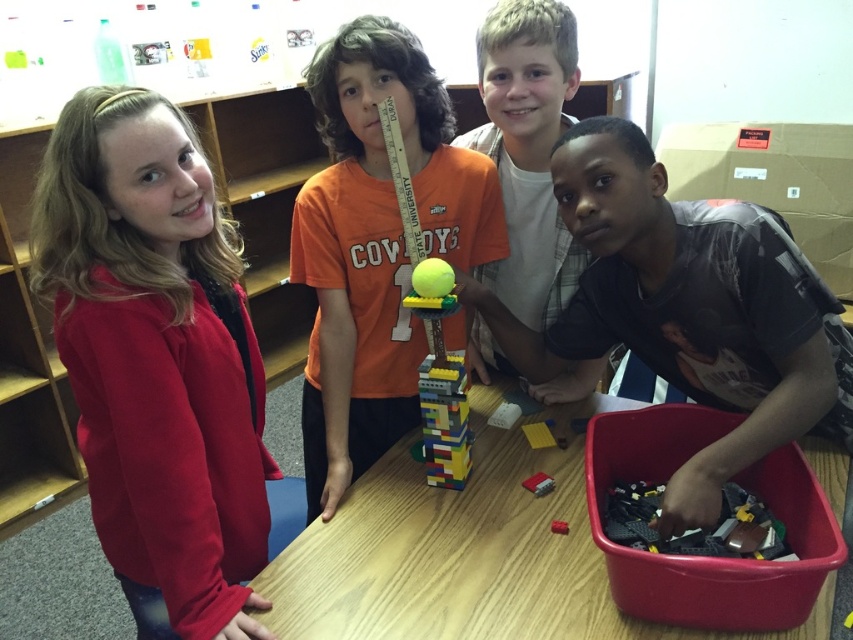
Question: Can you confirm if matte red sweater at left is smaller than bright yellow plastic ball at center?

Choices:
 (A) yes
 (B) no

Answer: (B)

Question: Which is farther from the bright yellow plastic ball at center?

Choices:
 (A) smooth plastic lego block at center
 (B) rubberized red brick at center
 (C) matte red brick at center

Answer: (C)

Question: Is matte red sweater at left thinner than bright yellow plastic ball at center?

Choices:
 (A) no
 (B) yes

Answer: (A)

Question: Which point appears closest to the camera in this image?

Choices:
 (A) (314, 401)
 (B) (560, 532)
 (C) (618, 193)

Answer: (C)

Question: Is matte red sweater at left wider than matte red brick at center?

Choices:
 (A) no
 (B) yes

Answer: (B)

Question: Which point appears farthest from the camera in this image?

Choices:
 (A) (335, 580)
 (B) (646, 538)
 (C) (503, 417)
 (D) (564, 58)

Answer: (C)